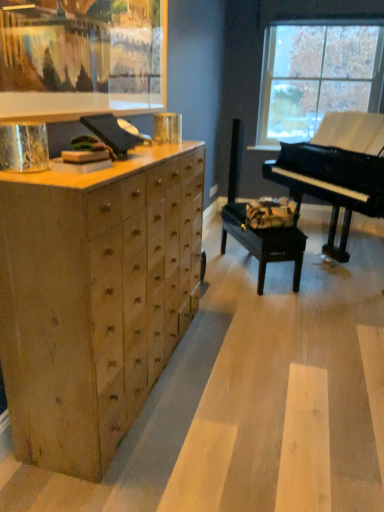
Question: Is transparent glass window at upper right bigger than black wood music stool at center?

Choices:
 (A) no
 (B) yes

Answer: (A)

Question: Is transparent glass window at upper right positioned with its back to black wood music stool at center?

Choices:
 (A) no
 (B) yes

Answer: (A)

Question: From a real-world perspective, is transparent glass window at upper right physically above black wood music stool at center?

Choices:
 (A) no
 (B) yes

Answer: (B)

Question: Is transparent glass window at upper right to the left of black wood music stool at center from the viewer's perspective?

Choices:
 (A) no
 (B) yes

Answer: (A)

Question: Is black wood music stool at center inside transparent glass window at upper right?

Choices:
 (A) yes
 (B) no

Answer: (B)

Question: Is wooden picture frame at upper left in front of or behind natural wood chest of drawers at left in the image?

Choices:
 (A) behind
 (B) front

Answer: (A)

Question: Is wooden picture frame at upper left taller or shorter than natural wood chest of drawers at left?

Choices:
 (A) short
 (B) tall

Answer: (A)

Question: From a real-world perspective, is wooden picture frame at upper left above or below natural wood chest of drawers at left?

Choices:
 (A) below
 (B) above

Answer: (B)

Question: Is wooden picture frame at upper left inside or outside of natural wood chest of drawers at left?

Choices:
 (A) inside
 (B) outside

Answer: (B)

Question: In terms of width, does black wood music stool at center look wider or thinner when compared to transparent glass window at upper right?

Choices:
 (A) thin
 (B) wide

Answer: (B)

Question: Considering the positions of point (294, 269) and point (264, 139), is point (294, 269) closer or farther from the camera than point (264, 139)?

Choices:
 (A) closer
 (B) farther

Answer: (A)

Question: From a real-world perspective, relative to transparent glass window at upper right, is black wood music stool at center vertically above or below?

Choices:
 (A) below
 (B) above

Answer: (A)

Question: Relative to transparent glass window at upper right, is black wood music stool at center in front or behind?

Choices:
 (A) front
 (B) behind

Answer: (A)

Question: Considering the positions of black wood music stool at center and natural wood chest of drawers at left in the image, is black wood music stool at center bigger or smaller than natural wood chest of drawers at left?

Choices:
 (A) big
 (B) small

Answer: (B)

Question: Is black wood music stool at center spatially inside natural wood chest of drawers at left, or outside of it?

Choices:
 (A) outside
 (B) inside

Answer: (A)